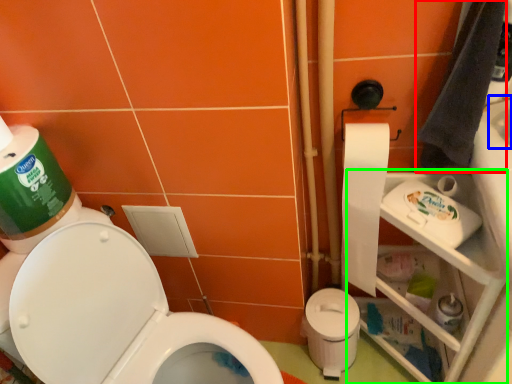
Question: Which object is the closest to the hand towel (highlighted by a red box)? Choose among these: sink (highlighted by a blue box) or shelf (highlighted by a green box).

Choices:
 (A) sink
 (B) shelf

Answer: (A)